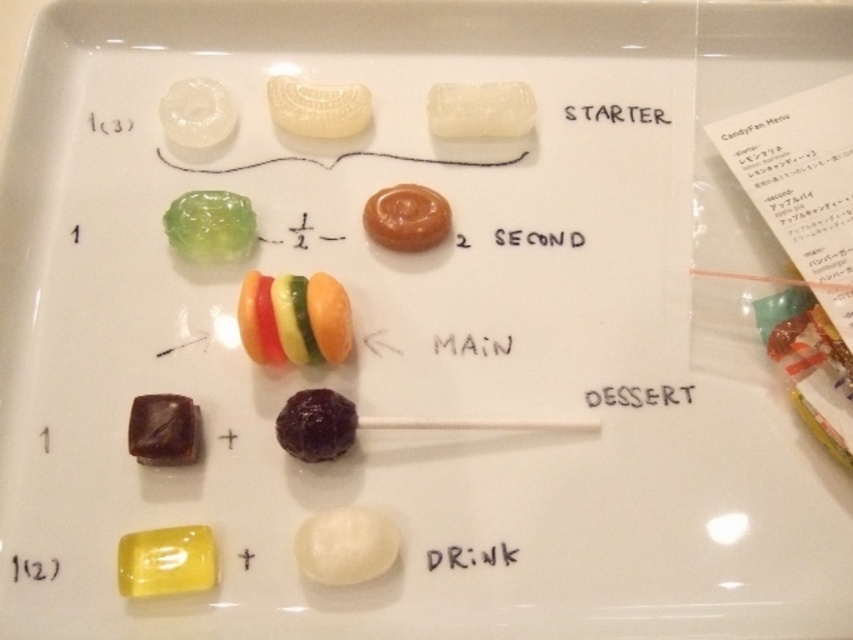
You are a food inspector checking the arrangement of candies on the tray. According to the image, which candy is positioned closer to you between the white glossy candy at lower center and the dark chocolate cube at lower left?

The white glossy candy at lower center is positioned closer to you because it is in front of the dark chocolate cube at lower left.

You are a candy enthusiast who wants to find the translucent white candy at center on the tray. Based on the coordinates provided, can you determine its exact position relative to the other sections?

The translucent white candy at center is located at coordinates (318, 108), which places it in the center section of the tray, likely within the MAIN section as described in the scene.

You are holding a candy that is 1.5 feet wide. You want to place it on the white glossy candy at lower center without overlapping any other candies. Is there enough space? Please explain your reasoning.

The white glossy candy at lower center and camera are 3.55 feet apart, but the distance between the candies isn not provided. Therefore, it is unclear if there is enough space to place the 1.5 feet wide candy without overlapping other candies.